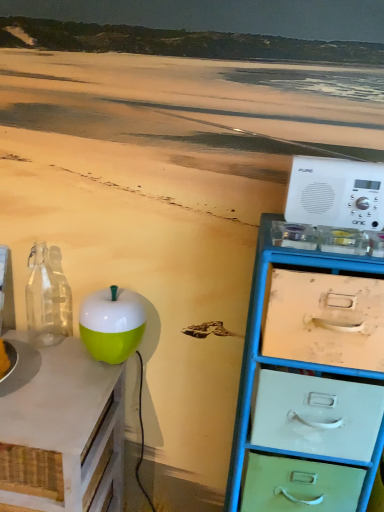
Question: Is white plastic radio at right wider than metallic blue chest of drawers at right?

Choices:
 (A) no
 (B) yes

Answer: (A)

Question: Would you say white plastic radio at right contains metallic blue chest of drawers at right?

Choices:
 (A) yes
 (B) no

Answer: (B)

Question: Does white plastic radio at right have a smaller size compared to metallic blue chest of drawers at right?

Choices:
 (A) no
 (B) yes

Answer: (B)

Question: Is white plastic radio at right looking in the opposite direction of metallic blue chest of drawers at right?

Choices:
 (A) yes
 (B) no

Answer: (B)

Question: From the image's perspective, is white plastic radio at right under metallic blue chest of drawers at right?

Choices:
 (A) yes
 (B) no

Answer: (B)

Question: In terms of width, does metallic blue chest of drawers at right look wider or thinner when compared to green matte apple at left?

Choices:
 (A) wide
 (B) thin

Answer: (B)

Question: Is metallic blue chest of drawers at right situated inside green matte apple at left or outside?

Choices:
 (A) outside
 (B) inside

Answer: (A)

Question: Visually, is metallic blue chest of drawers at right positioned to the left or to the right of green matte apple at left?

Choices:
 (A) right
 (B) left

Answer: (A)

Question: Considering the positions of point (271, 503) and point (31, 429), is point (271, 503) closer or farther from the camera than point (31, 429)?

Choices:
 (A) farther
 (B) closer

Answer: (A)

Question: Is metallic blue chest of drawers at right bigger or smaller than transparent glass bottle at left?

Choices:
 (A) small
 (B) big

Answer: (B)

Question: From a real-world perspective, is metallic blue chest of drawers at right above or below transparent glass bottle at left?

Choices:
 (A) above
 (B) below

Answer: (B)

Question: From their relative heights in the image, would you say metallic blue chest of drawers at right is taller or shorter than transparent glass bottle at left?

Choices:
 (A) tall
 (B) short

Answer: (A)

Question: Is metallic blue chest of drawers at right situated inside transparent glass bottle at left or outside?

Choices:
 (A) inside
 (B) outside

Answer: (B)

Question: Is transparent glass bottle at left inside or outside of metallic blue chest of drawers at right?

Choices:
 (A) inside
 (B) outside

Answer: (B)

Question: Considering the positions of transparent glass bottle at left and metallic blue chest of drawers at right in the image, is transparent glass bottle at left wider or thinner than metallic blue chest of drawers at right?

Choices:
 (A) wide
 (B) thin

Answer: (B)